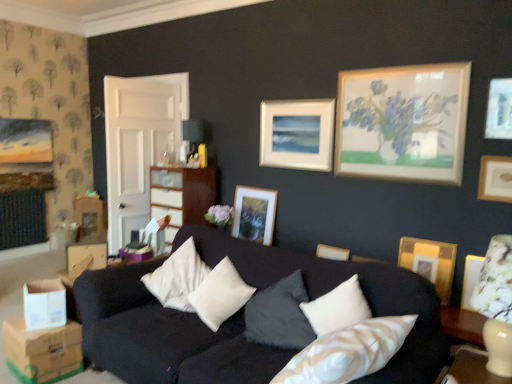
Question: Considering the positions of matte cream dresser at center and gold textured picture frame at right, the third picture frame positioned from the left, in the image, is matte cream dresser at center bigger or smaller than gold textured picture frame at right, the third picture frame positioned from the left,?

Choices:
 (A) big
 (B) small

Answer: (A)

Question: Considering the positions of matte cream dresser at center and gold textured picture frame at right, which is the 2th picture frame in right-to-left order, in the image, is matte cream dresser at center wider or thinner than gold textured picture frame at right, which is the 2th picture frame in right-to-left order,?

Choices:
 (A) wide
 (B) thin

Answer: (A)

Question: Considering the real-world distances, which object is farthest from the brown cardboard box at lower left, the 1th cardboard box ordered from the bottom?

Choices:
 (A) matte white picture frame at center, which is the third picture frame from front to back
 (B) gold textured picture frame at right, which is the 2th picture frame in right-to-left order
 (C) white cardboard box at lower left, the second cardboard box ordered from the bottom
 (D) wooden picture frame at upper right, acting as the 4th picture frame starting from the back
 (E) white soft cushion at center

Answer: (D)

Question: Based on their relative distances, which object is nearer to the white cardboard box at lower left, the second cardboard box ordered from the bottom?

Choices:
 (A) white soft cushion at center
 (B) gold textured picture frame at right, acting as the second picture frame starting from the front
 (C) matte cream dresser at center
 (D) matte gold picture frame at center, marked as the 4th picture frame in a right-to-left arrangement
 (E) brown cardboard box at lower left, placed as the 2th cardboard box when sorted from top to bottom

Answer: (E)